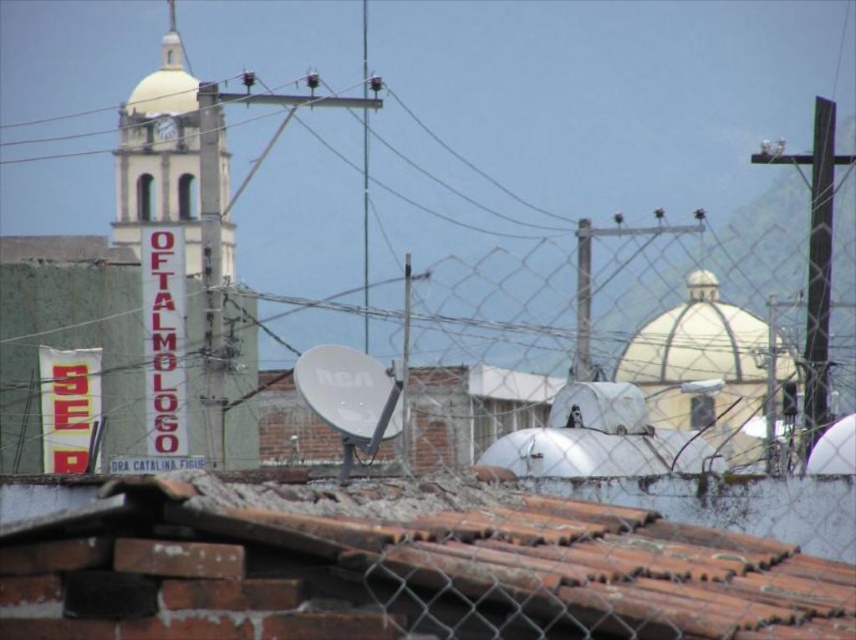
Question: Is dark brown wooden pole at right closer to the viewer compared to white concrete tower at left?

Choices:
 (A) yes
 (B) no

Answer: (B)

Question: Is white concrete tower at left thinner than metallic pole at center?

Choices:
 (A) no
 (B) yes

Answer: (A)

Question: Is white concrete tower at left smaller than metallic pole at center?

Choices:
 (A) no
 (B) yes

Answer: (A)

Question: Estimate the real-world distances between objects in this image. Which object is farther from the dark brown wooden pole at right?

Choices:
 (A) white plastic satellite dish at center
 (B) white concrete tower at left
 (C) metallic pole at center

Answer: (A)

Question: Which object appears farthest from the camera in this image?

Choices:
 (A) metallic pole at center
 (B) white plastic satellite dish at center
 (C) dark brown wooden pole at right

Answer: (A)

Question: Which of the following is the closest to the observer?

Choices:
 (A) white concrete tower at left
 (B) white plastic satellite dish at center
 (C) dark brown wooden pole at right

Answer: (B)